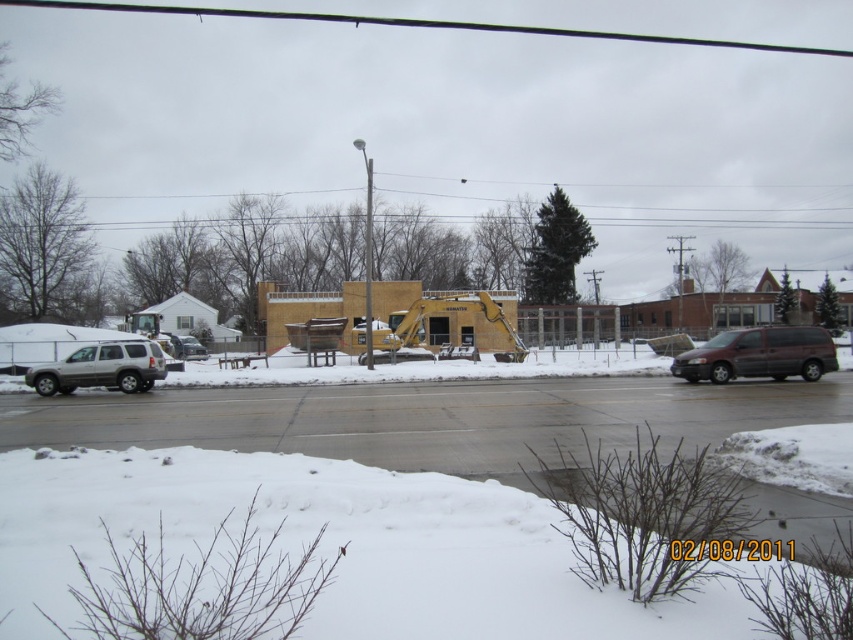
You are a delivery driver who needs to park your truck between the dark gray matte van at right and the silver metallic suv at left. The truck requires a minimum of 20 meters of space to park safely. Based on the scene, is there enough space between them to park your truck?

The distance between the dark gray matte van at right and the silver metallic suv at left is 19.24 meters, which is less than the required 20 meters. Therefore, there is not enough space to park the truck safely between them.

You are standing at the construction site and want to reach a specific point marked at coordinates point [534,532]. If your maximum comfortable walking distance is 5 meters, can you comfortably walk to that point without needing to move further?

The distance of point [534,532] from camera is 4.96 meters, so yes, you can comfortably walk to that point since it is within your 5 meters limit.

From the picture: You are a delivery driver who needs to park your truck in the area shown. You see the white fluffy snow at lower center and the silver metallic suv at left. Which area has more space to park your truck?

The silver metallic suv at left occupies more space than the white fluffy snow at lower center, so the area near the silver metallic suv at left has more space available for parking.